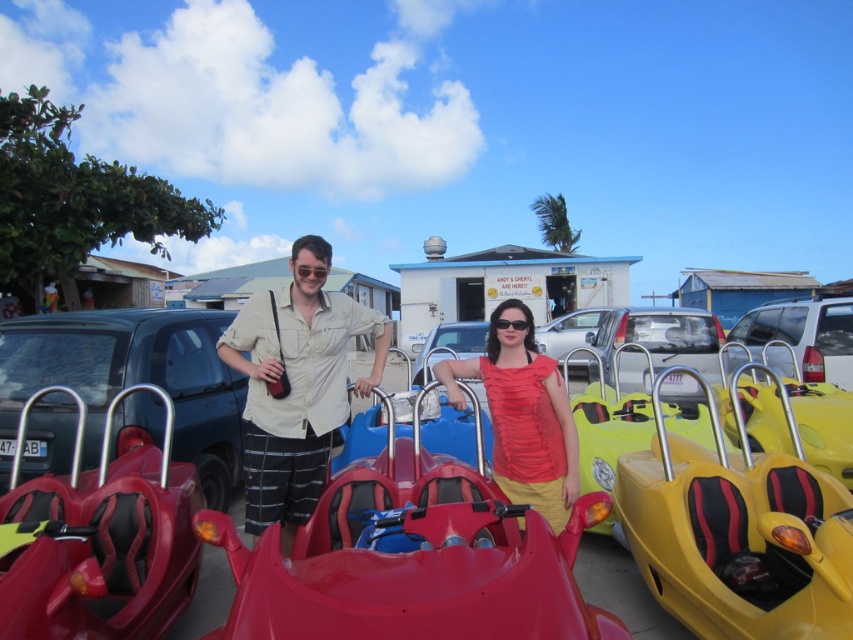
Question: Which object appears farthest from the camera in this image?

Choices:
 (A) shiny plastic toy car at center
 (B) yellow matte toy car at lower right
 (C) matte red shirt at center

Answer: (C)

Question: Does yellow matte toy car at lower right come in front of white matte suv at center?

Choices:
 (A) no
 (B) yes

Answer: (B)

Question: Considering the real-world distances, which object is closest to the metallic red toy car at left?

Choices:
 (A) matte red shirt at center
 (B) yellow matte toy car at lower right

Answer: (A)

Question: In this image, where is matte black car at center located relative to white matte suv at center?

Choices:
 (A) right
 (B) left

Answer: (B)

Question: Which object is the farthest from the shiny plastic toy car at center?

Choices:
 (A) matte silver car at center
 (B) metallic red toy car at left

Answer: (A)

Question: Can you confirm if beige cotton shirt at center is bigger than white matte suv at center?

Choices:
 (A) no
 (B) yes

Answer: (B)